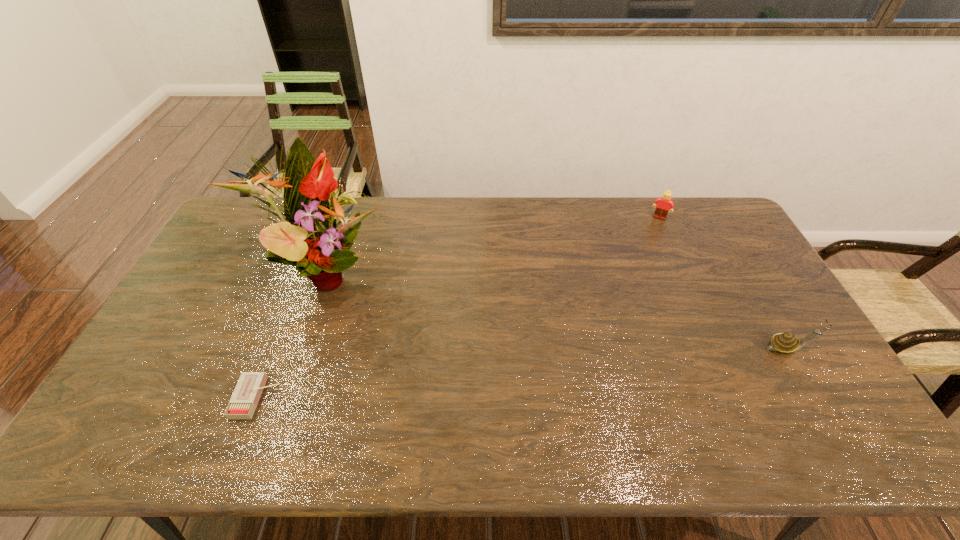
You are a GUI agent. You are given a task and a screenshot of the screen. Output one action in this format:
    pyautogui.click(x=<x>, y=<y>)
    Task: Click on the nearest object
    
    Given the screenshot: What is the action you would take?
    pyautogui.click(x=244, y=400)

Where is `matchbox`? This screenshot has height=540, width=960. matchbox is located at coordinates (244, 400).

Find the location of a particular element. the third farthest object is located at coordinates (x=786, y=343).

Locate an element on the screen. The height and width of the screenshot is (540, 960). snail is located at coordinates (786, 343).

Where is `Lego`? The width and height of the screenshot is (960, 540). Lego is located at coordinates (665, 202).

I want to click on the second object from right to left, so click(x=665, y=202).

Find the location of a particular element. bouquet is located at coordinates (307, 238).

Identify the location of the second farthest object. The width and height of the screenshot is (960, 540). (307, 238).

Where is `free space located 0.250m on the striking surface of the nearest object`? free space located 0.250m on the striking surface of the nearest object is located at coordinates (374, 397).

The width and height of the screenshot is (960, 540). I want to click on free space located 0.330m on the face of the Lego, so click(632, 278).